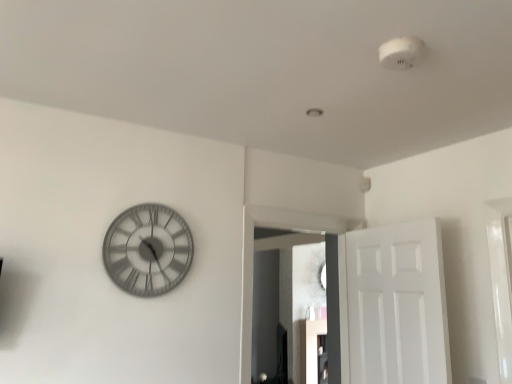
Find the location of `metallic gray clock at left`. metallic gray clock at left is located at coordinates (148, 250).

Describe the element at coordinates (287, 301) in the screenshot. I see `matte glass mirror at center` at that location.

The width and height of the screenshot is (512, 384). I want to click on white matte door at right, so click(393, 305).

Looking at this image, is matte glass mirror at center smaller than metallic gray clock at left?

Incorrect, matte glass mirror at center is not smaller in size than metallic gray clock at left.

From the image's perspective, is matte glass mirror at center below metallic gray clock at left?

Correct, matte glass mirror at center appears lower than metallic gray clock at left in the image.

Between matte glass mirror at center and metallic gray clock at left, which one has more height?

With more height is matte glass mirror at center.

Based on their positions, is matte glass mirror at center located to the left or right of metallic gray clock at left?

In the image, matte glass mirror at center appears on the right side of metallic gray clock at left.

Could you tell me if matte glass mirror at center is turned towards white matte door at right?

Yes, matte glass mirror at center is oriented towards white matte door at right.

Between matte glass mirror at center and white matte door at right, which one is positioned in front?

Positioned in front is white matte door at right.

Is matte glass mirror at center thinner than white matte door at right?

No, matte glass mirror at center is not thinner than white matte door at right.

Is point (294, 314) more distant than point (367, 296)?

Yes.

Is white matte door at right turned away from metallic gray clock at left?

No, white matte door at right is not facing away from metallic gray clock at left.

Considering the positions of point (388, 231) and point (185, 240), is point (388, 231) closer or farther from the camera than point (185, 240)?

Point (388, 231) is positioned farther from the camera compared to point (185, 240).

From the picture: Is white matte door at right positioned before metallic gray clock at left?

No, white matte door at right is further to the viewer.

From a real-world perspective, between white matte door at right and metallic gray clock at left, who is vertically lower?

white matte door at right, from a real-world perspective.

Is white matte door at right with matte glass mirror at center?

No, white matte door at right is not touching matte glass mirror at center.

Consider the image. Is white matte door at right facing towards matte glass mirror at center?

Yes, white matte door at right is oriented towards matte glass mirror at center.

Which of these two, white matte door at right or matte glass mirror at center, stands taller?

matte glass mirror at center is taller.

Can you confirm if white matte door at right is smaller than matte glass mirror at center?

Correct, white matte door at right occupies less space than matte glass mirror at center.

From the picture: From a real-world perspective, is metallic gray clock at left above or below white matte door at right?

Clearly, from a real-world perspective, metallic gray clock at left is above white matte door at right.

Between metallic gray clock at left and white matte door at right, which one has larger size?

white matte door at right is bigger.

The width and height of the screenshot is (512, 384). Identify the location of wall clock located in front of the white matte door at right. (148, 250).

Is metallic gray clock at left not inside matte glass mirror at center?

Yes, metallic gray clock at left is located beyond the bounds of matte glass mirror at center.

Can you tell me how much metallic gray clock at left and matte glass mirror at center differ in facing direction?

The facing directions of metallic gray clock at left and matte glass mirror at center are 0.422 degrees apart.

Is metallic gray clock at left turned away from matte glass mirror at center?

metallic gray clock at left is not turned away from matte glass mirror at center.

From a real-world perspective, between metallic gray clock at left and matte glass mirror at center, who is vertically lower?

matte glass mirror at center, from a real-world perspective.

Image resolution: width=512 pixels, height=384 pixels. I want to click on wall clock in front of the matte glass mirror at center, so click(x=148, y=250).

At what (x,y) coordinates should I click in order to perform the action: click on door below the matte glass mirror at center (from a real-world perspective). Please return your answer as a coordinate pair (x, y). This screenshot has width=512, height=384. Looking at the image, I should click on (393, 305).

Estimate the real-world distances between objects in this image. Which object is further from white matte door at right, matte glass mirror at center or metallic gray clock at left?

matte glass mirror at center.

Consider the image. Which object lies nearer to the anchor point white matte door at right, metallic gray clock at left or matte glass mirror at center?

metallic gray clock at left is closer to white matte door at right.

From the image, which object appears to be nearer to metallic gray clock at left, matte glass mirror at center or white matte door at right?

Based on the image, white matte door at right appears to be nearer to metallic gray clock at left.

Based on their spatial positions, is metallic gray clock at left or white matte door at right further from matte glass mirror at center?

The object further to matte glass mirror at center is metallic gray clock at left.

Which object lies nearer to the anchor point metallic gray clock at left, white matte door at right or matte glass mirror at center?

white matte door at right.

Based on their spatial positions, is white matte door at right or metallic gray clock at left closer to matte glass mirror at center?

white matte door at right lies closer to matte glass mirror at center than the other object.

Where is `mirror between metallic gray clock at left and white matte door at right`? mirror between metallic gray clock at left and white matte door at right is located at coordinates point(287,301).